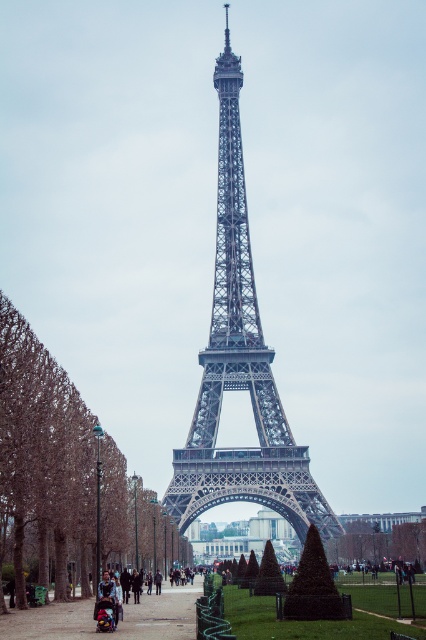
Which is below, smooth asphalt path at center or green leafy tree at center?

Positioned lower is smooth asphalt path at center.

Which is in front, point (2, 620) or point (351, 545)?

Point (2, 620) is more forward.

The height and width of the screenshot is (640, 426). In order to click on smooth asphalt path at center in this screenshot , I will do `click(118, 621)`.

Where is `metallic gray eiffel tower at center`? This screenshot has width=426, height=640. metallic gray eiffel tower at center is located at coordinates (239, 365).

Locate an element on the screen. metallic gray eiffel tower at center is located at coordinates (239, 365).

Is brown leafy tree at left taller than smooth asphalt path at center?

Indeed, brown leafy tree at left has a greater height compared to smooth asphalt path at center.

Who is positioned more to the right, brown leafy tree at left or smooth asphalt path at center?

From the viewer's perspective, smooth asphalt path at center appears more on the right side.

Is point (141, 556) behind point (141, 624)?

Yes, point (141, 556) is behind point (141, 624).

Where is `brown leafy tree at left`? This screenshot has height=640, width=426. brown leafy tree at left is located at coordinates (43, 467).